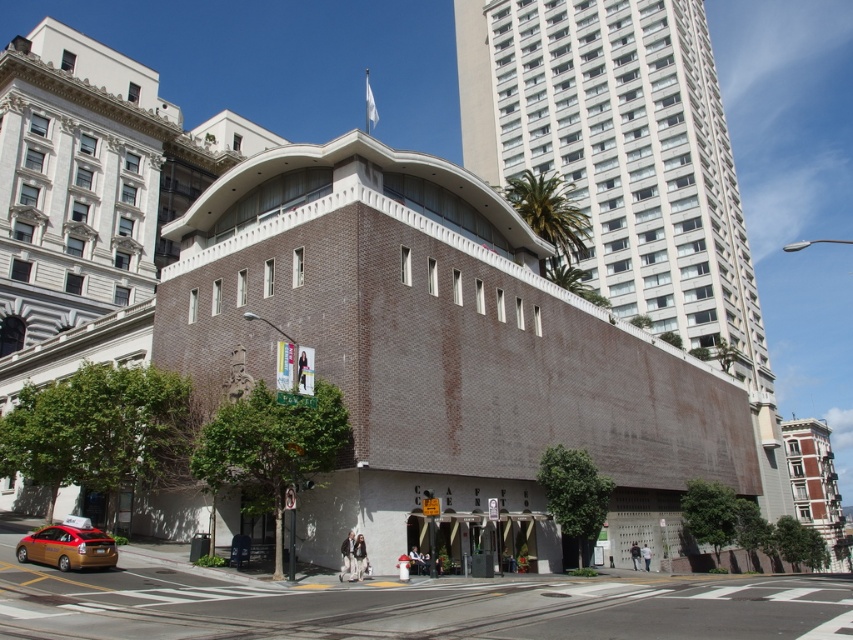
Which of these two, red brick building at right or gold metallic taxi at lower left, stands taller?

Standing taller between the two is red brick building at right.

Which of these two, red brick building at right or gold metallic taxi at lower left, stands shorter?

gold metallic taxi at lower left is shorter.

Which is behind, point (846, 547) or point (96, 529)?

Point (846, 547)

Locate an element on the screen. The height and width of the screenshot is (640, 853). red brick building at right is located at coordinates (815, 484).

Between point (252, 225) and point (688, 102), which one is positioned behind?

Point (688, 102)

Between brown brick building at center and smooth beige building at center, which one is positioned lower?

brown brick building at center is lower down.

Who is more forward, [403,433] or [770,390]?

Point [403,433]

The image size is (853, 640). Identify the location of brown brick building at center. (436, 346).

Between smooth beige building at center and red brick building at right, which one appears on the right side from the viewer's perspective?

Positioned to the right is red brick building at right.

The image size is (853, 640). What do you see at coordinates (628, 168) in the screenshot?
I see `smooth beige building at center` at bounding box center [628, 168].

Which is in front, point (705, 252) or point (805, 461)?

Point (705, 252) is in front.

Locate an element on the screen. The width and height of the screenshot is (853, 640). smooth beige building at center is located at coordinates (628, 168).